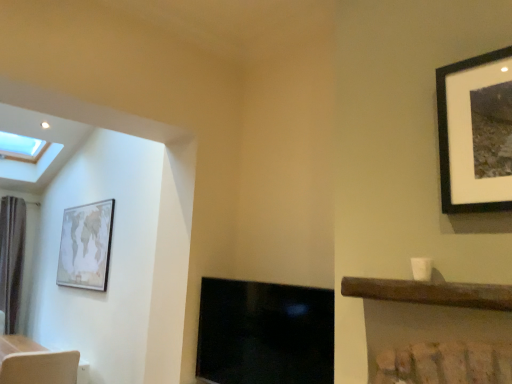
Question: Is light brown textured swivel chair at lower left further to the viewer compared to dark brown fabric curtain at left?

Choices:
 (A) no
 (B) yes

Answer: (A)

Question: Does light brown textured swivel chair at lower left have a larger size compared to dark brown fabric curtain at left?

Choices:
 (A) no
 (B) yes

Answer: (B)

Question: Does light brown textured swivel chair at lower left appear on the right side of dark brown fabric curtain at left?

Choices:
 (A) no
 (B) yes

Answer: (B)

Question: Is light brown textured swivel chair at lower left beside dark brown fabric curtain at left?

Choices:
 (A) no
 (B) yes

Answer: (A)

Question: Does light brown textured swivel chair at lower left appear on the left side of dark brown fabric curtain at left?

Choices:
 (A) yes
 (B) no

Answer: (B)

Question: In the image, is matte wooden map at left positioned in front of or behind black glossy fireplace at center?

Choices:
 (A) front
 (B) behind

Answer: (B)

Question: Considering the positions of matte wooden map at left and black glossy fireplace at center in the image, is matte wooden map at left taller or shorter than black glossy fireplace at center?

Choices:
 (A) short
 (B) tall

Answer: (B)

Question: Considering the positions of matte wooden map at left and black glossy fireplace at center in the image, is matte wooden map at left wider or thinner than black glossy fireplace at center?

Choices:
 (A) thin
 (B) wide

Answer: (A)

Question: From a real-world perspective, is matte wooden map at left positioned above or below black glossy fireplace at center?

Choices:
 (A) above
 (B) below

Answer: (A)

Question: Is black glossy fireplace at center taller or shorter than dark brown fabric curtain at left?

Choices:
 (A) short
 (B) tall

Answer: (A)

Question: Choose the correct answer: Is black glossy fireplace at center inside dark brown fabric curtain at left or outside it?

Choices:
 (A) inside
 (B) outside

Answer: (B)

Question: From a real-world perspective, relative to dark brown fabric curtain at left, is black glossy fireplace at center vertically above or below?

Choices:
 (A) above
 (B) below

Answer: (B)

Question: From the image's perspective, is black glossy fireplace at center above or below dark brown fabric curtain at left?

Choices:
 (A) above
 (B) below

Answer: (A)

Question: From their relative heights in the image, would you say light brown textured swivel chair at lower left is taller or shorter than black glossy fireplace at center?

Choices:
 (A) short
 (B) tall

Answer: (A)

Question: Is light brown textured swivel chair at lower left inside the boundaries of black glossy fireplace at center, or outside?

Choices:
 (A) inside
 (B) outside

Answer: (B)